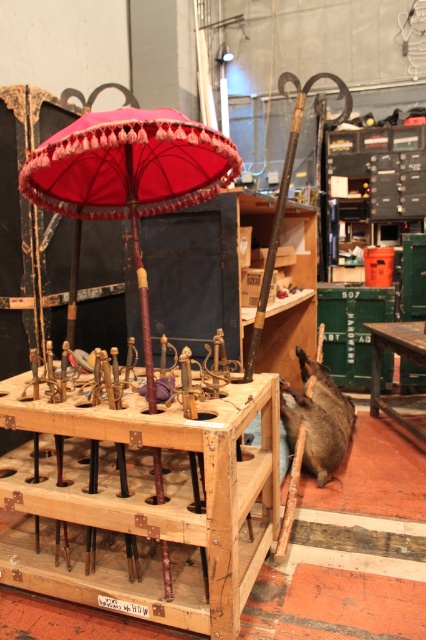
Can you confirm if wooden at center is bigger than velvet pink parasol at center?

No.

At what (x,y) coordinates should I click in order to perform the action: click on wooden at center. Please return your answer as a coordinate pair (x, y). The image size is (426, 640). Looking at the image, I should click on (141, 502).